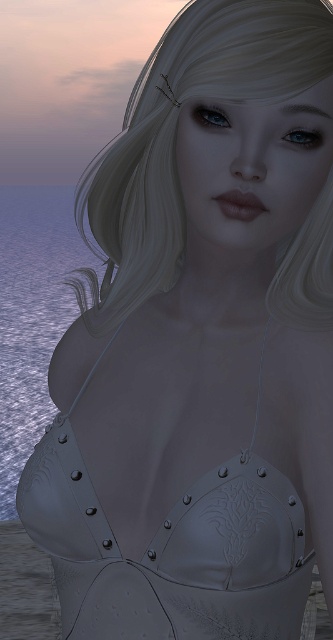
You are an artist trying to sketch the silver metallic corset at center. Based on the scene description, where should you place it on your canvas if the coordinate system starts from the bottom left corner as origin?

The silver metallic corset at center should be placed at the coordinate point of 0.858 on the x axis and 0.514 on the y axis, as this corresponds to its 2D location in the image.

You are a fashion designer who needs to create a replica of the silver metallic corset at center. To ensure accuracy, you need to know the exact distance between the corset and the viewer. Can you determine if the corset is closer than 24 inches to the viewer?

The silver metallic corset at center is 22.18 inches away from the viewer, which is less than 24 inches. Therefore, the corset is closer than 24 inches to the viewer.